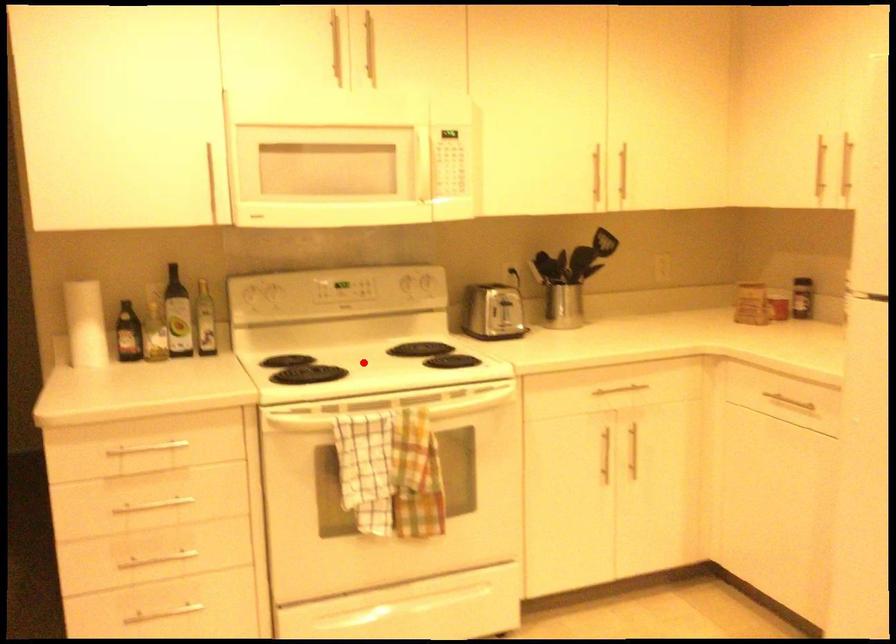
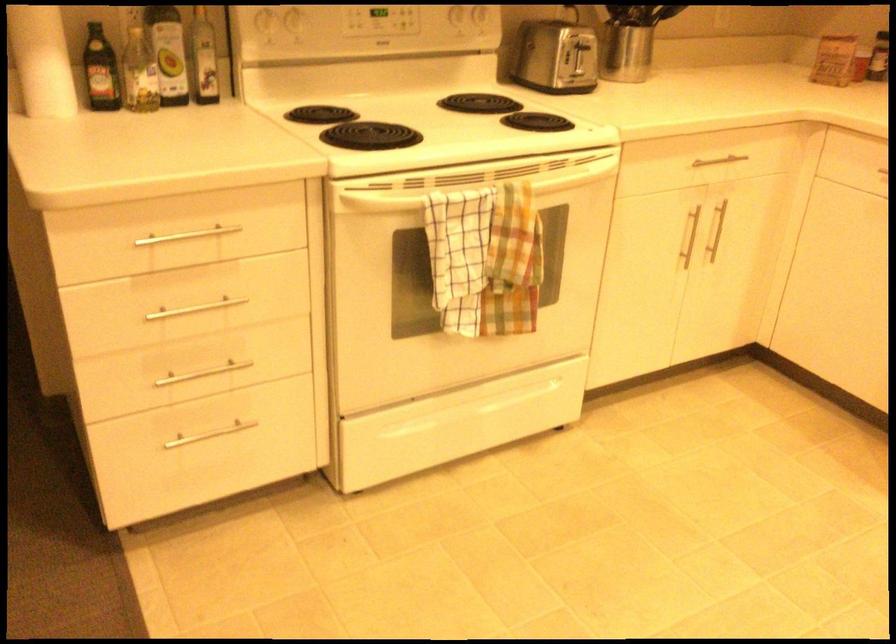
Question: I am providing you with two images of the same scene from different viewpoints. A red point is marked on the first image. At the location where the point appears in image 1, is it still visible in image 2?

Choices:
 (A) Yes
 (B) No

Answer: (B)